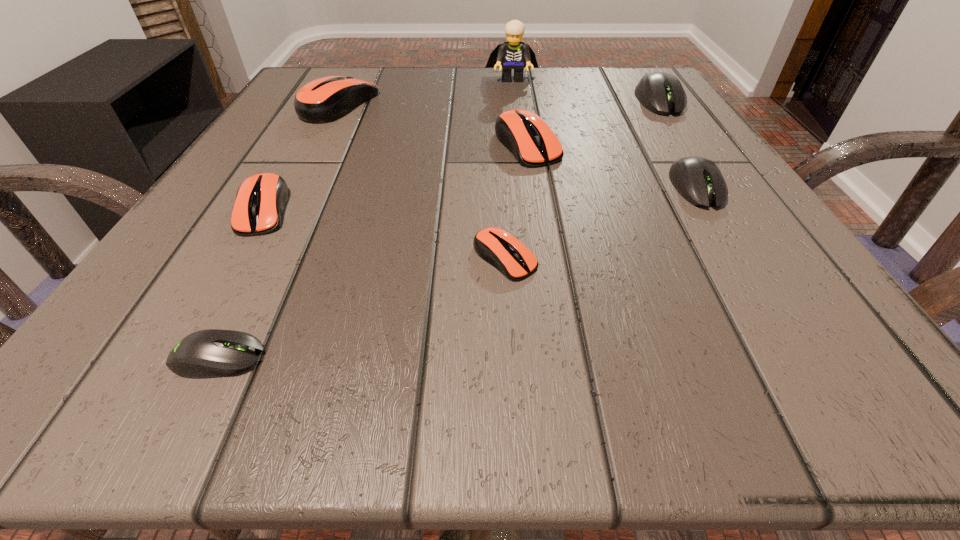
Locate an element on the screen. vacant area that lies between the second biggest orange computer mouse and the smallest orange computer mouse is located at coordinates [x=516, y=201].

Where is `unoccupied area between the nearest object and the second nearest gray computer mouse`? unoccupied area between the nearest object and the second nearest gray computer mouse is located at coordinates (457, 272).

The height and width of the screenshot is (540, 960). I want to click on free area in between the biggest gray computer mouse and the smallest orange computer mouse, so click(582, 179).

At what (x,y) coordinates should I click in order to perform the action: click on unoccupied area between the nearest computer mouse and the tallest object. Please return your answer as a coordinate pair (x, y). The image size is (960, 540). Looking at the image, I should click on (366, 218).

You are a GUI agent. You are given a task and a screenshot of the screen. Output one action in this format:
    pyautogui.click(x=<x>, y=<y>)
    Task: Click on the free area in between the second farthest gray computer mouse and the smallest orange computer mouse
    This screenshot has width=960, height=540.
    Given the screenshot: What is the action you would take?
    pyautogui.click(x=600, y=222)

Where is `free space between the Lego and the biggest orange computer mouse`? Image resolution: width=960 pixels, height=540 pixels. free space between the Lego and the biggest orange computer mouse is located at coordinates [x=426, y=91].

Image resolution: width=960 pixels, height=540 pixels. Identify the location of vacant space that is in between the biggest gray computer mouse and the smallest orange computer mouse. (582, 179).

Identify which object is located as the seventh nearest to the third smallest orange computer mouse. Please provide its 2D coordinates. Your answer should be formatted as a tuple, i.e. [(x, y)], where the tuple contains the x and y coordinates of a point satisfying the conditions above.

[(212, 353)]

Select which object is the second closest to the second smallest orange computer mouse. Please provide its 2D coordinates. Your answer should be formatted as a tuple, i.e. [(x, y)], where the tuple contains the x and y coordinates of a point satisfying the conditions above.

[(324, 100)]

Locate an element on the screen. the fifth closest computer mouse to the third smallest orange computer mouse is located at coordinates (260, 200).